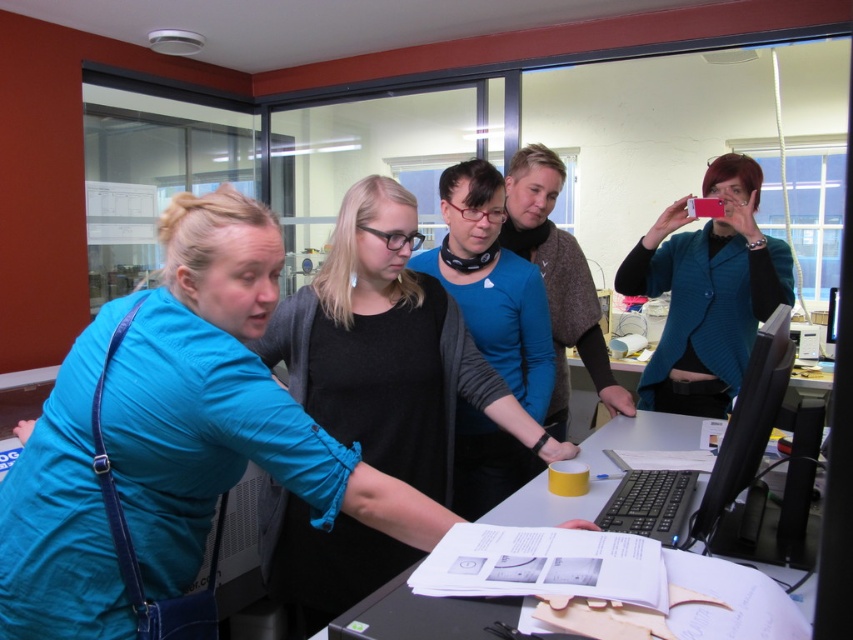
Question: Is teal textured blazer at upper right bigger than matte black shirt at center?

Choices:
 (A) yes
 (B) no

Answer: (A)

Question: Which object is closer to the camera taking this photo?

Choices:
 (A) teal textured blazer at upper right
 (B) blue fabric shirt at center
 (C) blue sweater at center

Answer: (B)

Question: Is teal textured blazer at upper right below matte black shirt at center?

Choices:
 (A) yes
 (B) no

Answer: (B)

Question: Which point is closer to the camera?

Choices:
 (A) (676, 445)
 (B) (340, 273)
 (C) (532, 209)

Answer: (B)

Question: Does blue fabric shirt at center lie behind black glossy monitor at right?

Choices:
 (A) no
 (B) yes

Answer: (B)

Question: Which object appears closest to the camera in this image?

Choices:
 (A) black glossy monitor at right
 (B) blue sweater at center
 (C) teal textured blazer at upper right
 (D) matte black shirt at center

Answer: (A)